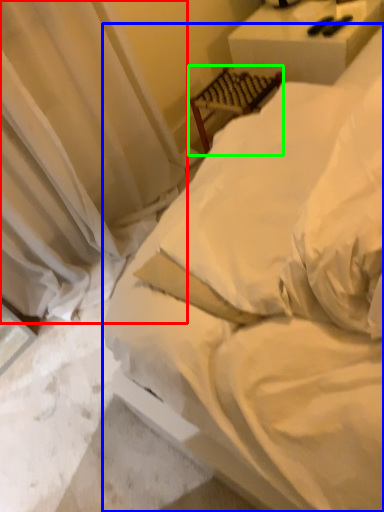
Question: Which object is positioned farthest from curtain (highlighted by a red box)? Select from bed (highlighted by a blue box) and furniture (highlighted by a green box).

Choices:
 (A) bed
 (B) furniture

Answer: (A)